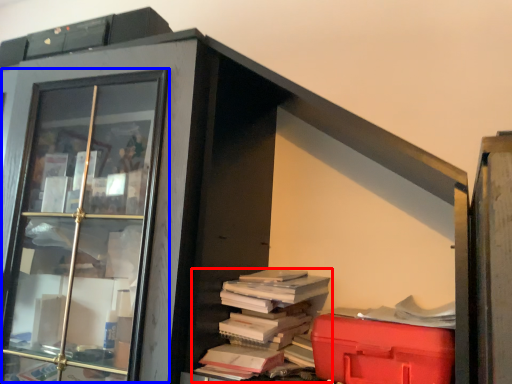
Question: Which point is further to the camera, book (highlighted by a red box) or glass door (highlighted by a blue box)?

Choices:
 (A) book
 (B) glass door

Answer: (A)